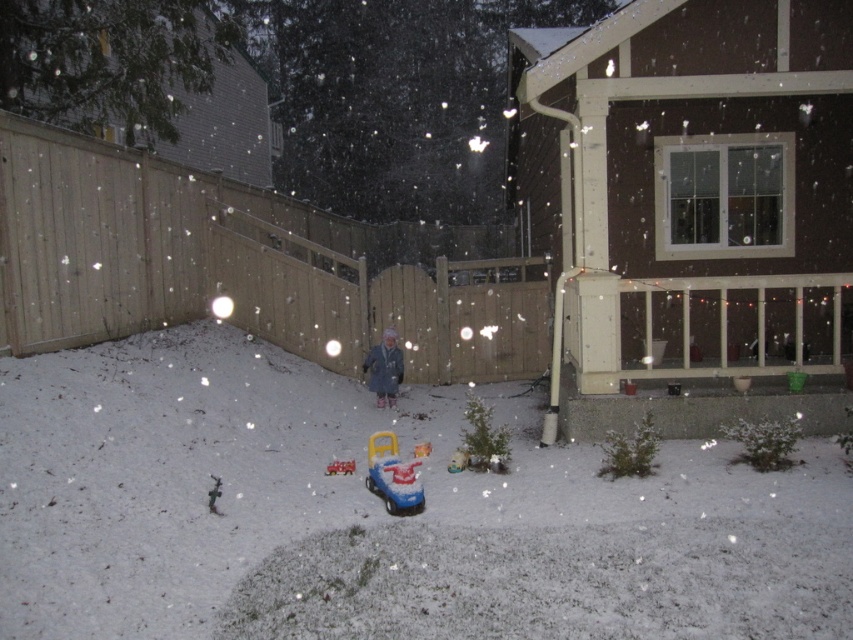
You are a parent looking for your child who is playing outside in the snowy backyard. You see the blue plastic toy car at center and the matte gray coat at center. Which object is closer to the right side of the scene?

The blue plastic toy car at center is to the right of the matte gray coat at center, so it is closer to the right side of the scene.

You are a parent trying to find your child two different toy cars in the snow. You see the blue plastic toy car at center and the shiny plastic toy car at center. Which one is larger in size?

The blue plastic toy car at center is bigger than the shiny plastic toy car at center.